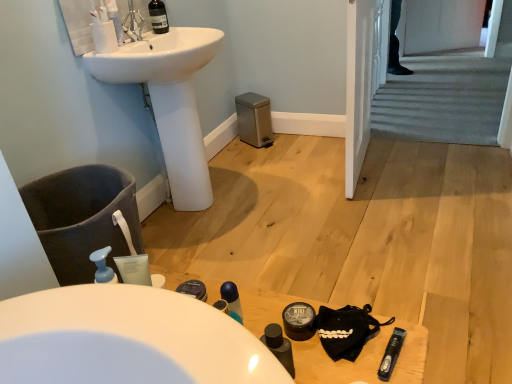
Find the location of a particular element. This screenshot has width=512, height=384. free spot to the right of blue plastic mouthwash at center, which appears as the second mouthwash when viewed from the back is located at coordinates (294, 336).